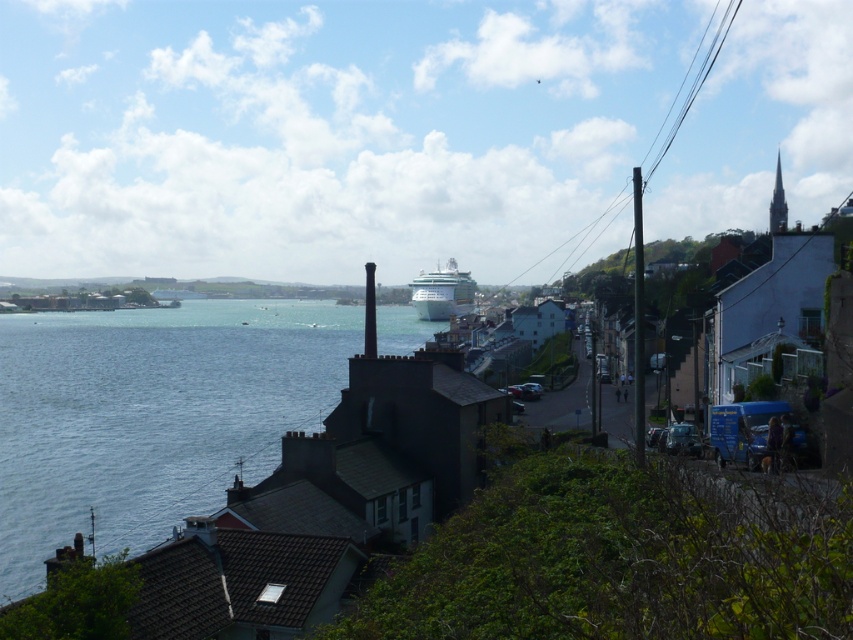
Between blue water at lower left and white glossy cruise ship at center, which one appears on the right side from the viewer's perspective?

Positioned to the right is white glossy cruise ship at center.

Is the position of blue water at lower left less distant than that of white glossy cruise ship at center?

That is True.

Which is in front, point (25, 417) or point (440, 273)?

Point (25, 417) is in front.

The image size is (853, 640). What are the coordinates of `blue water at lower left` in the screenshot? It's located at (151, 416).